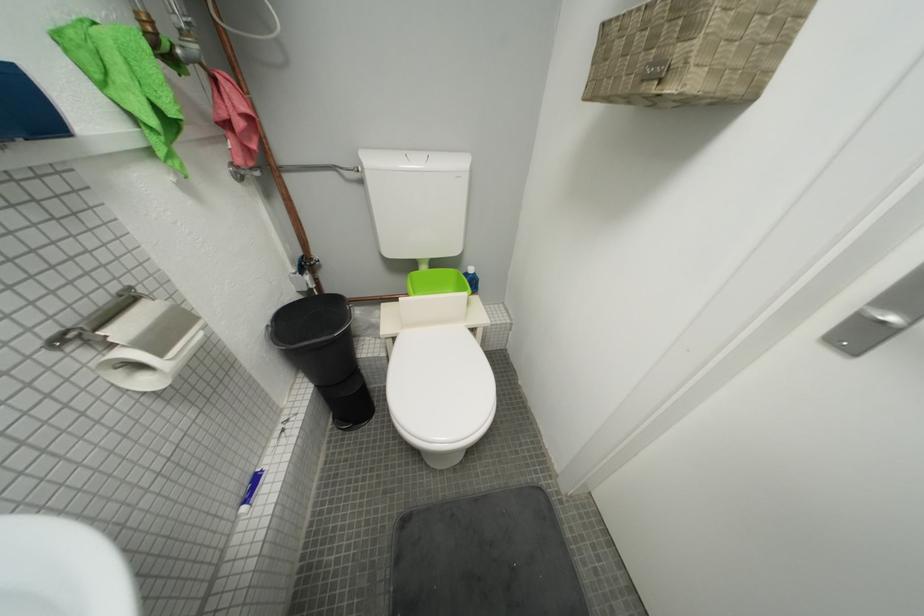
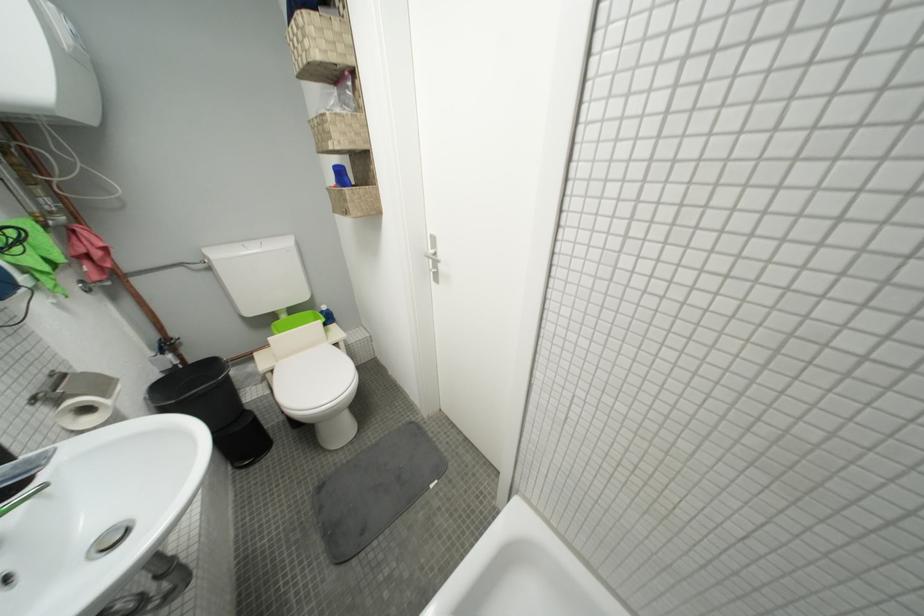
In the second image, find the point that corresponds to (x=433, y=270) in the first image.

(293, 318)